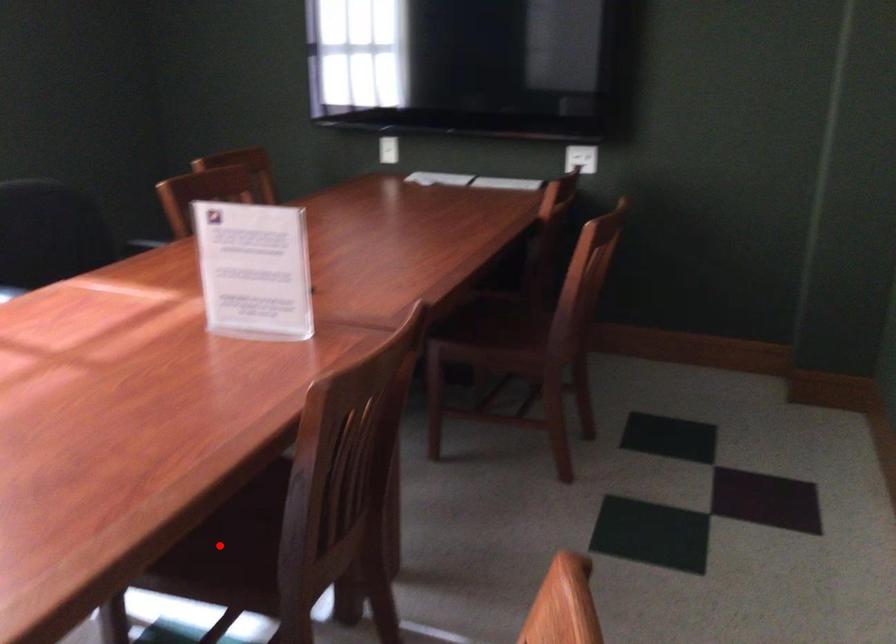
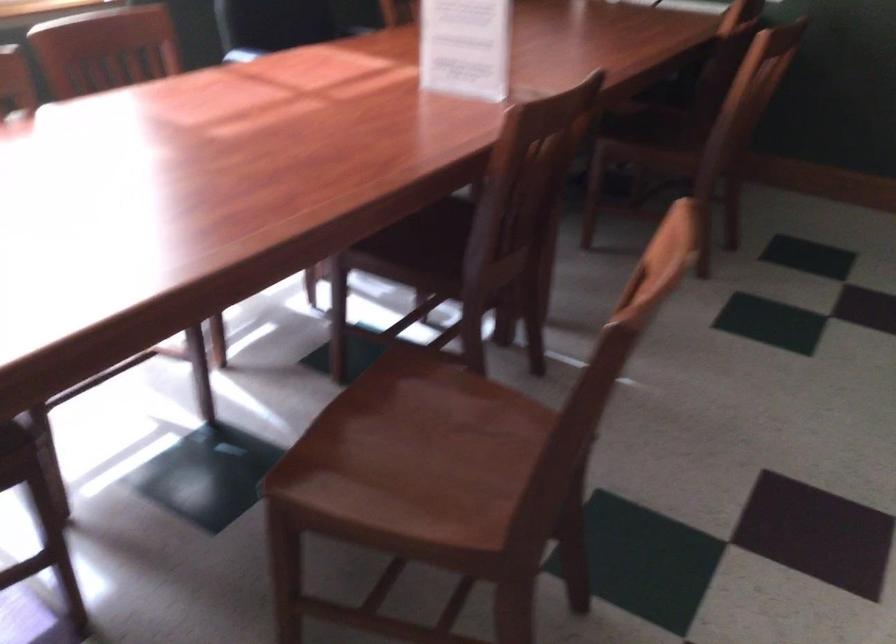
Question: A red point is marked in image1. In image2, is the corresponding 3D point closer to the camera or farther? Reply with the corresponding letter.

Choices:
 (A) The corresponding 3D point is closer.
 (B) The corresponding 3D point is farther.

Answer: (B)